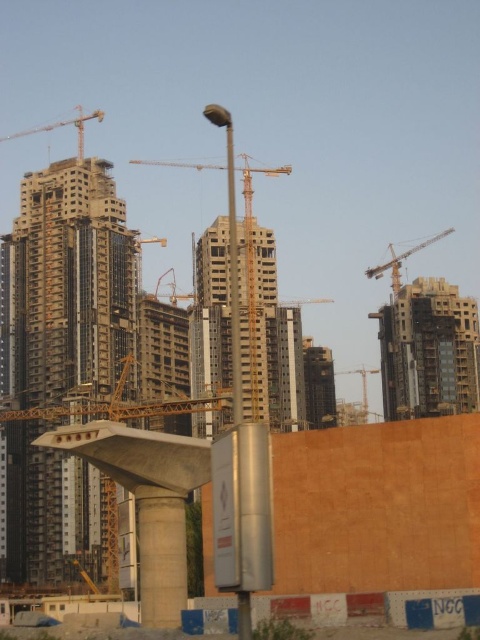
What does the point at coordinates (212,312) represent in the urban construction site scene?

The point at coordinates (212,312) corresponds to the concrete building at center.